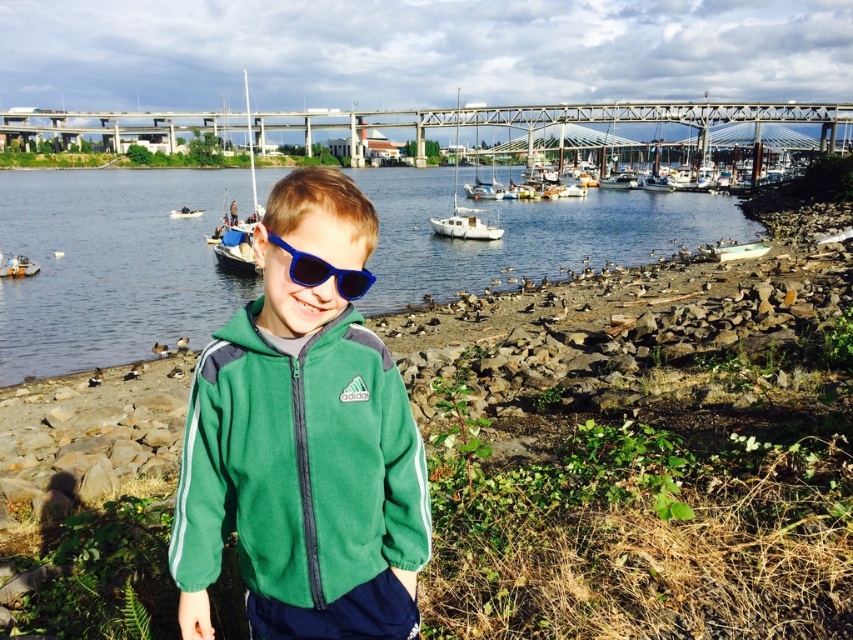
Question: Does clear water at center have a lesser width compared to blue plastic sunglasses at center?

Choices:
 (A) yes
 (B) no

Answer: (B)

Question: Does blue plastic sunglasses at center have a lesser width compared to white matte sailboat at center?

Choices:
 (A) yes
 (B) no

Answer: (A)

Question: Estimate the real-world distances between objects in this image. Which object is farther from the white plastic boat at left?

Choices:
 (A) white plastic sailboat at center
 (B) white plastic boat at center

Answer: (A)

Question: Which point is closer to the camera?

Choices:
 (A) white matte sailboat at center
 (B) blue plastic sunglasses at center
 (C) white plastic boat at center

Answer: (B)

Question: Can you confirm if green fleece jacket at center is positioned to the right of white plastic boat at left?

Choices:
 (A) yes
 (B) no

Answer: (A)

Question: Which point is closer to the camera taking this photo?

Choices:
 (A) (173, 218)
 (B) (16, 266)
 (C) (221, 259)
 (D) (364, 280)

Answer: (D)